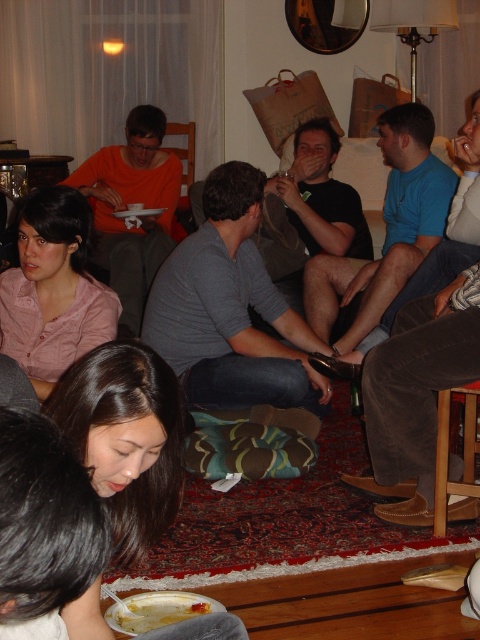
Question: Which point appears closest to the camera in this image?

Choices:
 (A) (392, 339)
 (B) (171, 600)

Answer: (B)

Question: Is blue corduroy pants at lower right wider than white plastic fork at lower center?

Choices:
 (A) yes
 (B) no

Answer: (A)

Question: Which of the following is the farthest from the observer?

Choices:
 (A) (459, 326)
 (B) (212, 600)

Answer: (A)

Question: Does blue corduroy pants at lower right appear over white plastic fork at lower center?

Choices:
 (A) yes
 (B) no

Answer: (A)

Question: Does blue corduroy pants at lower right appear on the left side of white plastic fork at lower center?

Choices:
 (A) no
 (B) yes

Answer: (A)